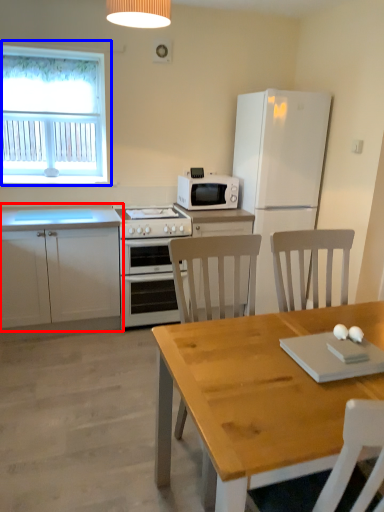
Question: Which point is further to the camera, cabinetry (highlighted by a red box) or window (highlighted by a blue box)?

Choices:
 (A) cabinetry
 (B) window

Answer: (B)